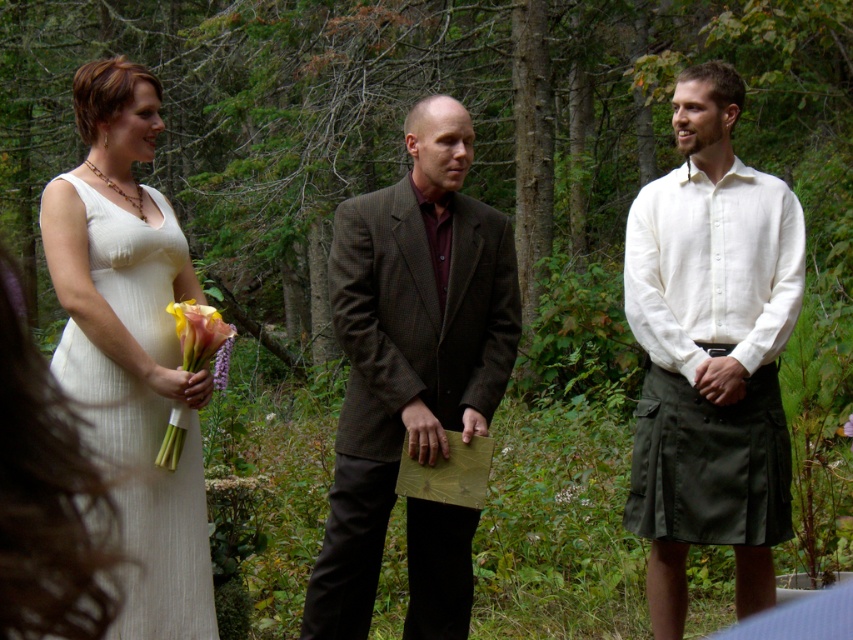
Is point (683, 216) in front of point (155, 611)?

No, it is not.

Can you confirm if white linen shirt at center is positioned below white textured dress at left?

No.

Who is more forward, [737,333] or [144,340]?

Point [144,340]

Image resolution: width=853 pixels, height=640 pixels. What are the coordinates of `white linen shirt at center` in the screenshot? It's located at (711, 353).

Who is higher up, brown wool suit at center or white textured dress at left?

Positioned higher is brown wool suit at center.

Measure the distance from brown wool suit at center to white textured dress at left.

brown wool suit at center and white textured dress at left are 36.09 inches apart from each other.

This screenshot has width=853, height=640. I want to click on brown wool suit at center, so click(409, 346).

Does brown wool suit at center come behind soft pink calla lily at left?

Yes, it is behind soft pink calla lily at left.

Measure the distance from brown wool suit at center to soft pink calla lily at left.

They are 28.35 inches apart.

Locate an element on the screen. This screenshot has height=640, width=853. brown wool suit at center is located at coordinates (409, 346).